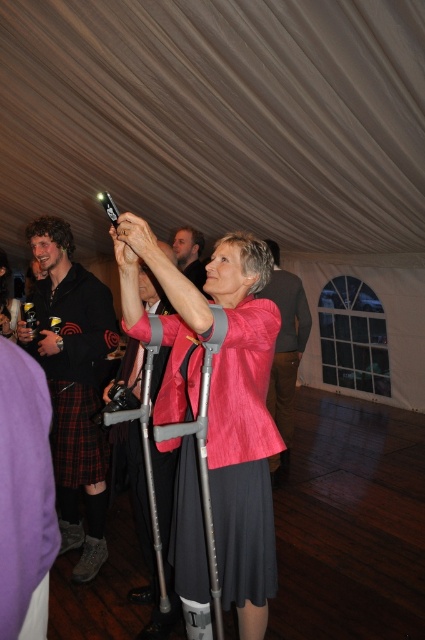
Is pink fabric crutches at center below metallic gray crutch at center?

Actually, pink fabric crutches at center is above metallic gray crutch at center.

Which is in front, point (127, 269) or point (212, 560)?

Point (212, 560) is more forward.

This screenshot has width=425, height=640. Find the location of `pink fabric crutches at center`. pink fabric crutches at center is located at coordinates (243, 429).

Between pink fabric crutches at center and black kilt at left, which one appears on the left side from the viewer's perspective?

black kilt at left is more to the left.

Locate an element on the screen. This screenshot has height=640, width=425. pink fabric crutches at center is located at coordinates (243, 429).

Does pink fabric crutches at center come behind smooth skin face at center?

No, it is in front of smooth skin face at center.

Does pink fabric crutches at center appear under smooth skin face at center?

Yes, pink fabric crutches at center is below smooth skin face at center.

Does point (244, 465) come closer to viewer compared to point (204, 276)?

Yes, point (244, 465) is closer to viewer.

This screenshot has height=640, width=425. In order to click on pink fabric crutches at center in this screenshot , I will do `click(243, 429)`.